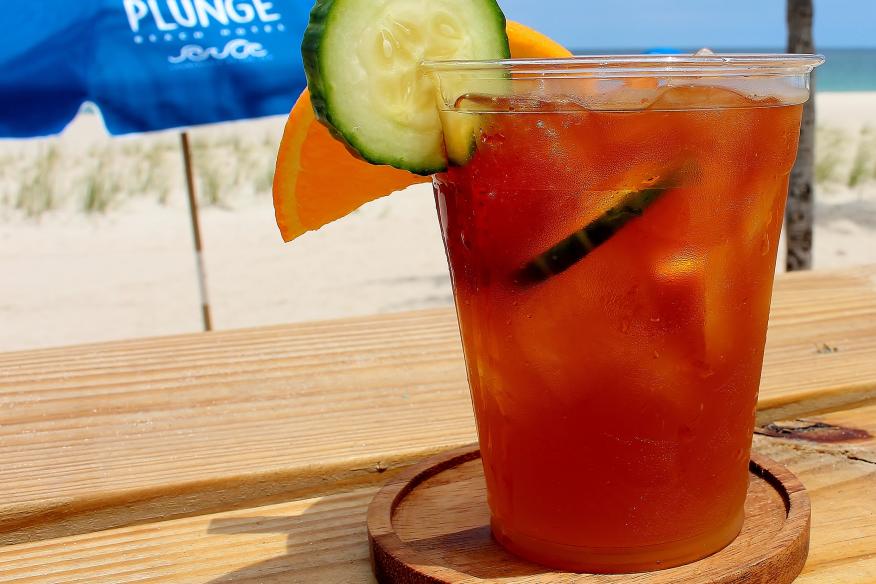
You are a GUI agent. You are given a task and a screenshot of the screen. Output one action in this format:
    pyautogui.click(x=<x>, y=<y>)
    Task: Click on the light brown table
    
    Given the screenshot: What is the action you would take?
    pyautogui.click(x=290, y=449)